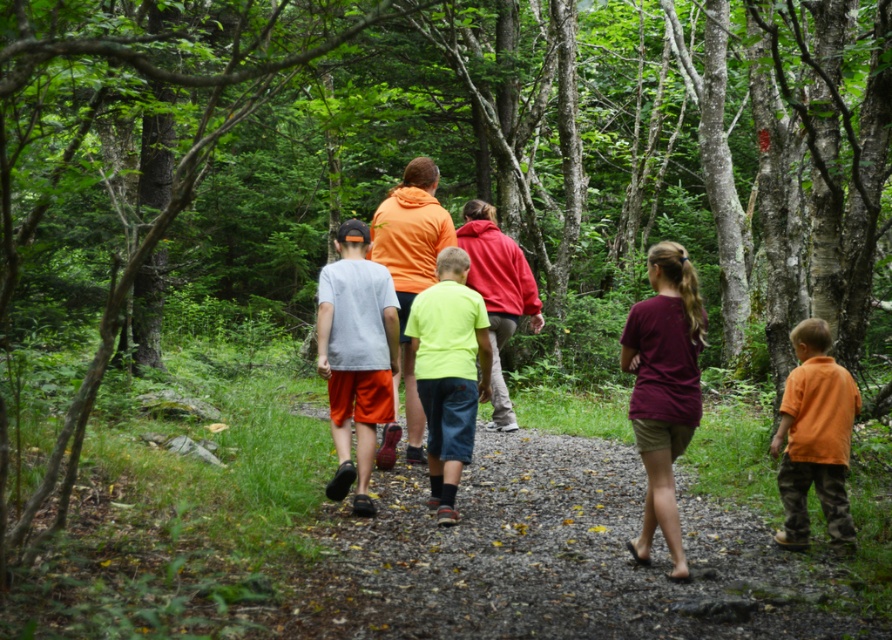
Question: Among these points, which one is nearest to the camera?

Choices:
 (A) (358, 513)
 (B) (457, 310)
 (C) (451, 225)
 (D) (665, 285)

Answer: (D)

Question: Which of the following is the farthest from the observer?

Choices:
 (A) (692, 275)
 (B) (800, 321)
 (C) (452, 262)

Answer: (C)

Question: Can you confirm if gray matte t-shirt at center is smaller than orange hoodie at center?

Choices:
 (A) no
 (B) yes

Answer: (B)

Question: Based on their relative distances, which object is farther from the gray matte t-shirt at center?

Choices:
 (A) orange cotton shirt at lower right
 (B) orange hoodie at center
 (C) neon green fabric shorts at center

Answer: (A)

Question: Considering the relative positions of neon green fabric shorts at center and orange hoodie at center in the image provided, where is neon green fabric shorts at center located with respect to orange hoodie at center?

Choices:
 (A) above
 (B) below

Answer: (B)

Question: Is the position of gray matte t-shirt at center less distant than that of orange hoodie at center?

Choices:
 (A) no
 (B) yes

Answer: (B)